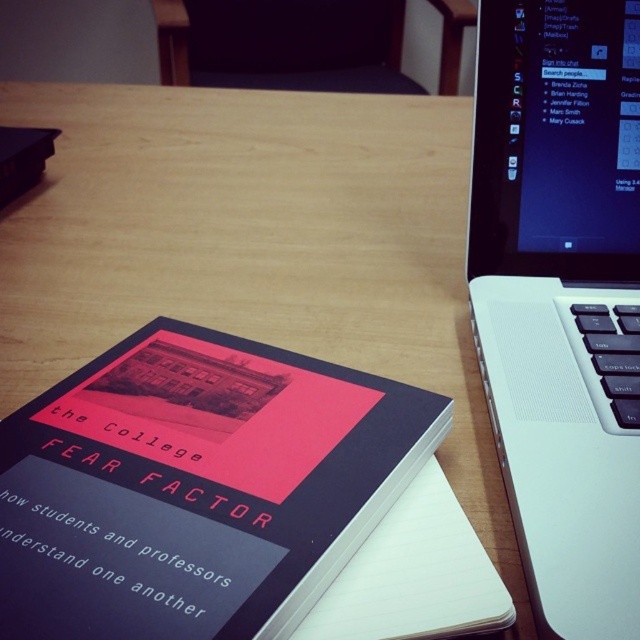
Does white plastic laptop at upper right have a lesser width compared to white paper at center?

No, white plastic laptop at upper right is not thinner than white paper at center.

Can you confirm if white plastic laptop at upper right is bigger than white paper at center?

Indeed, white plastic laptop at upper right has a larger size compared to white paper at center.

Is point (577, 273) closer to camera compared to point (417, 563)?

That is False.

Where is `white plastic laptop at upper right`? white plastic laptop at upper right is located at coordinates (561, 298).

Does matte black book at center-left have a lesser height compared to white paper at center?

In fact, matte black book at center-left may be taller than white paper at center.

Can you confirm if matte black book at center-left is thinner than white paper at center?

Incorrect, matte black book at center-left's width is not less than white paper at center's.

Describe the element at coordinates (196, 486) in the screenshot. This screenshot has height=640, width=640. I see `matte black book at center-left` at that location.

Where is `matte black book at center-left`? This screenshot has width=640, height=640. matte black book at center-left is located at coordinates (196, 486).

Which of these two, matte black book at center-left or white plastic laptop at upper right, stands taller?

With more height is white plastic laptop at upper right.

Is point (449, 417) behind point (531, 305)?

That is False.

At what (x,y) coordinates should I click in order to perform the action: click on matte black book at center-left. Please return your answer as a coordinate pair (x, y). Looking at the image, I should click on (196, 486).